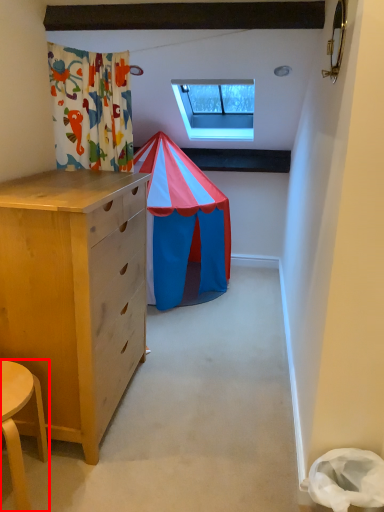
Question: Considering the relative positions of table (annotated by the red box) and window in the image provided, where is table (annotated by the red box) located with respect to the staircase?

Choices:
 (A) right
 (B) left

Answer: (B)